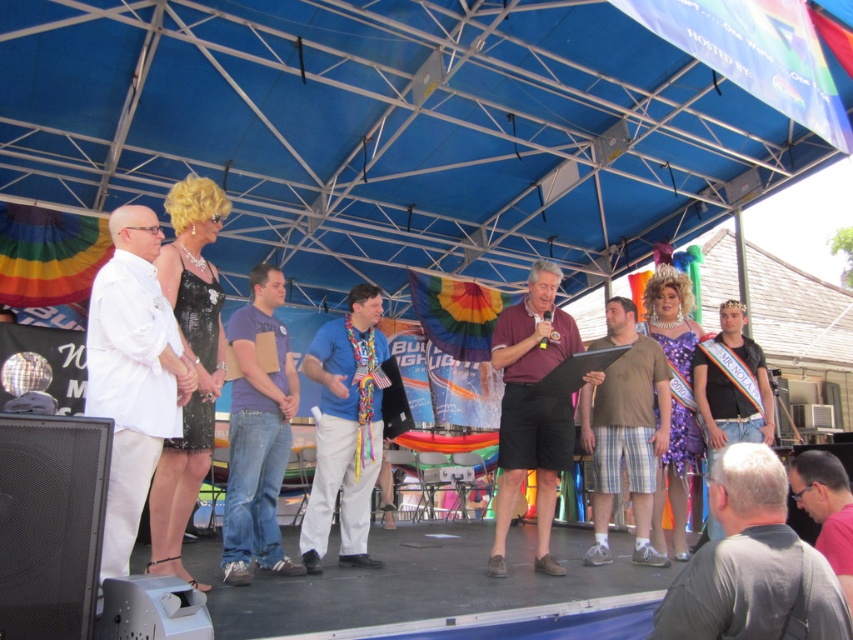
Question: Is white matte shirt at left wider than black leather sash at right?

Choices:
 (A) no
 (B) yes

Answer: (A)

Question: Considering the real-world distances, which object is farthest from the maroon fabric shirt at center?

Choices:
 (A) brown plaid shorts at center
 (B) purple cotton shirt at center
 (C) pink fabric at lower right
 (D) black leather sash at right

Answer: (C)

Question: Which object is positioned closest to the pink fabric at lower right?

Choices:
 (A) white matte shirt at left
 (B) black leather sash at right
 (C) maroon fabric shirt at center
 (D) gray fabric shirt at lower right

Answer: (D)

Question: Which point appears closest to the camera in this image?

Choices:
 (A) (804, 502)
 (B) (664, 448)
 (C) (544, 445)

Answer: (A)

Question: Is gray fabric shirt at lower right to the left of maroon fabric shirt at center from the viewer's perspective?

Choices:
 (A) yes
 (B) no

Answer: (B)

Question: Does white matte shirt at left appear over brown plaid shorts at center?

Choices:
 (A) yes
 (B) no

Answer: (A)